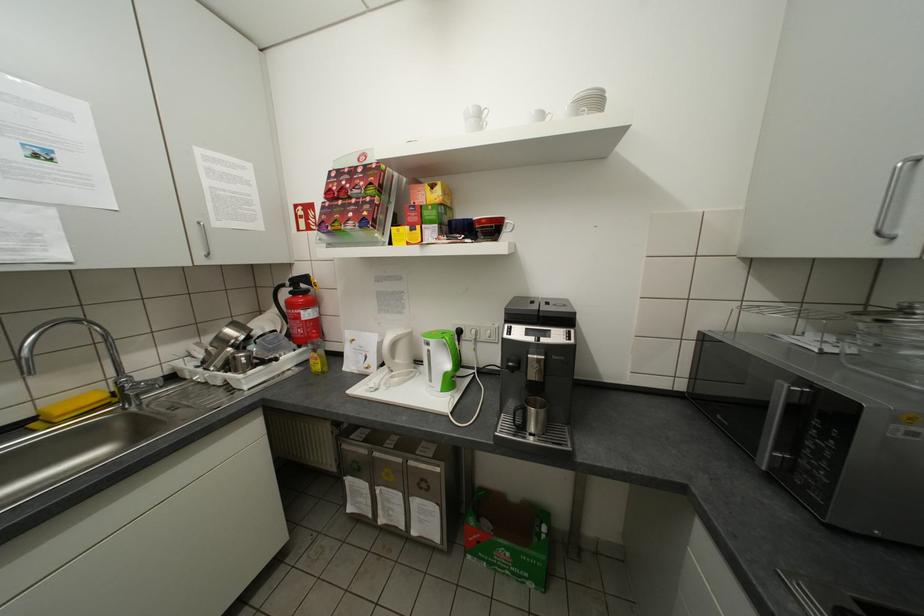
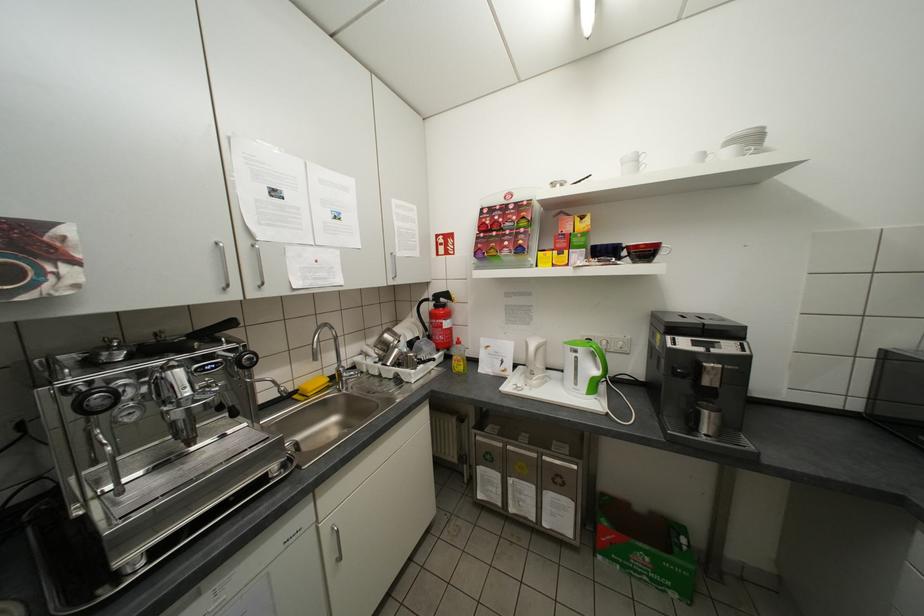
Find the pixel in the second image that matches point (117, 395) in the first image.

(336, 379)